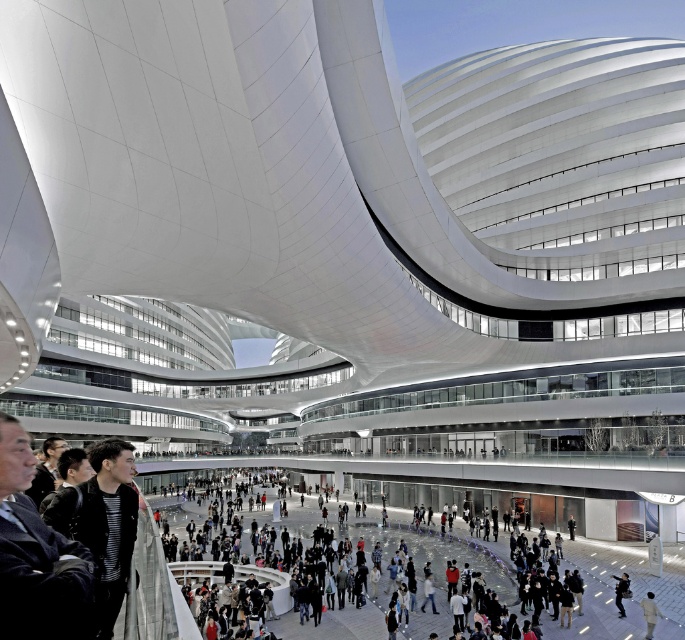
You are an interior designer assessing the modern architectural structure. You have two jackets, the white matte jacket at lower center and the dark gray fabric jacket at lower center. Which jacket would you recommend placing on a shelf that requires items to be at least 1.2 meters tall?

The white matte jacket at lower center is taller than the dark gray fabric jacket at lower center, so it would be the better choice for the shelf requiring items to be at least 1.2 meters tall.